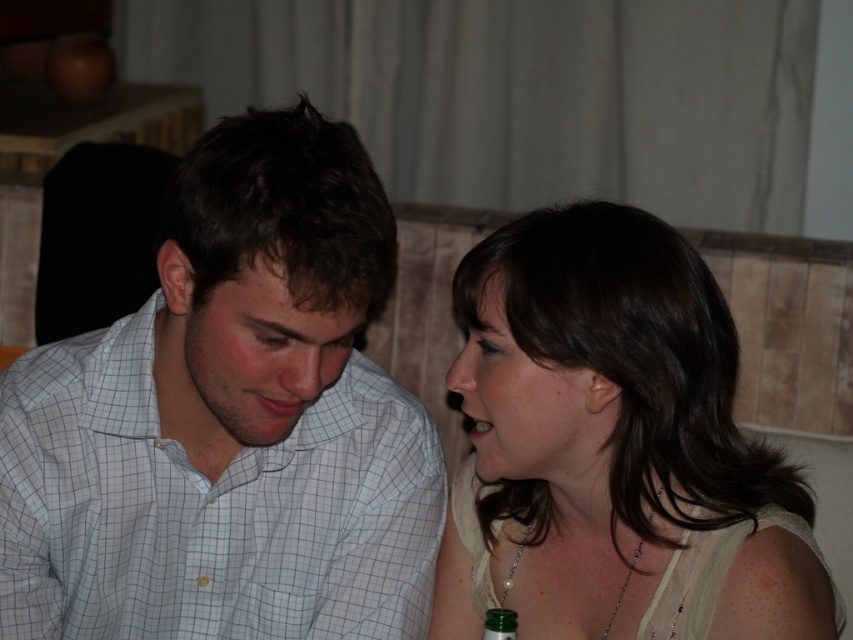
Who is taller, matte white blouse at center or green glass bottle at lower center?

matte white blouse at center is taller.

Between matte white blouse at center and green glass bottle at lower center, which one is positioned lower?

green glass bottle at lower center is below.

The image size is (853, 640). What are the coordinates of `matte white blouse at center` in the screenshot? It's located at (612, 444).

Can you confirm if white checkered shirt at center is wider than matte white blouse at center?

Yes, white checkered shirt at center is wider than matte white blouse at center.

Does point (268, 296) come in front of point (537, 608)?

That is True.

Where is `white checkered shirt at center`? Image resolution: width=853 pixels, height=640 pixels. white checkered shirt at center is located at coordinates (229, 420).

At what (x,y) coordinates should I click in order to perform the action: click on white checkered shirt at center. Please return your answer as a coordinate pair (x, y). Looking at the image, I should click on (229, 420).

Between white checkered shirt at center and green glass bottle at lower center, which one appears on the right side from the viewer's perspective?

From the viewer's perspective, green glass bottle at lower center appears more on the right side.

Is point (315, 564) farther from viewer compared to point (490, 612)?

Yes, point (315, 564) is behind point (490, 612).

At what (x,y) coordinates should I click in order to perform the action: click on white checkered shirt at center. Please return your answer as a coordinate pair (x, y). The image size is (853, 640). Looking at the image, I should click on (229, 420).